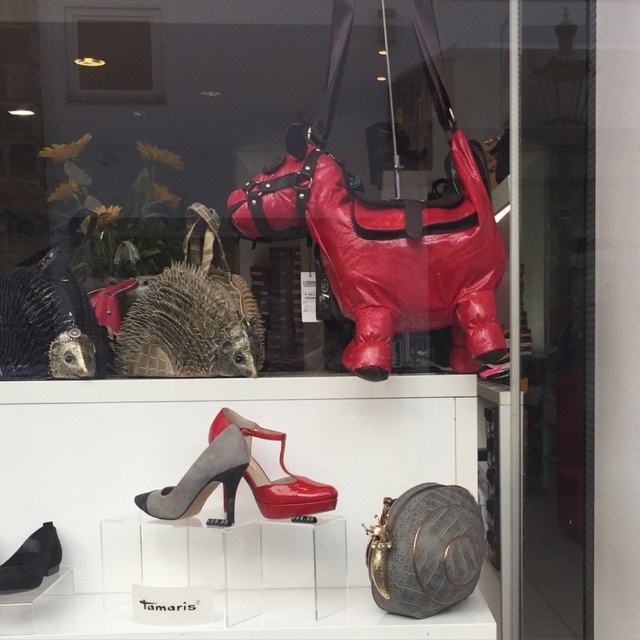
Question: Which of these objects is positioned farthest from the leather textured handbag at lower right?

Choices:
 (A) suede high-heeled shoe at center
 (B) black suede shoe at lower left

Answer: (B)

Question: Does leather textured handbag at lower right appear on the right side of black suede shoe at lower left?

Choices:
 (A) yes
 (B) no

Answer: (A)

Question: Is suede high-heeled shoe at center positioned in front of shiny patent leather high-heeled shoe at center?

Choices:
 (A) no
 (B) yes

Answer: (B)

Question: Considering the real-world distances, which object is closest to the leather textured handbag at lower right?

Choices:
 (A) suede high-heeled shoe at center
 (B) shiny red leather horse at upper center

Answer: (A)

Question: From the image, what is the correct spatial relationship of shiny red leather horse at upper center in relation to shiny patent leather high-heeled shoe at center?

Choices:
 (A) above
 (B) below

Answer: (A)

Question: Which object is the farthest from the shiny patent leather high-heeled shoe at center?

Choices:
 (A) leather textured handbag at lower right
 (B) metallic gold light fixture at upper center

Answer: (B)